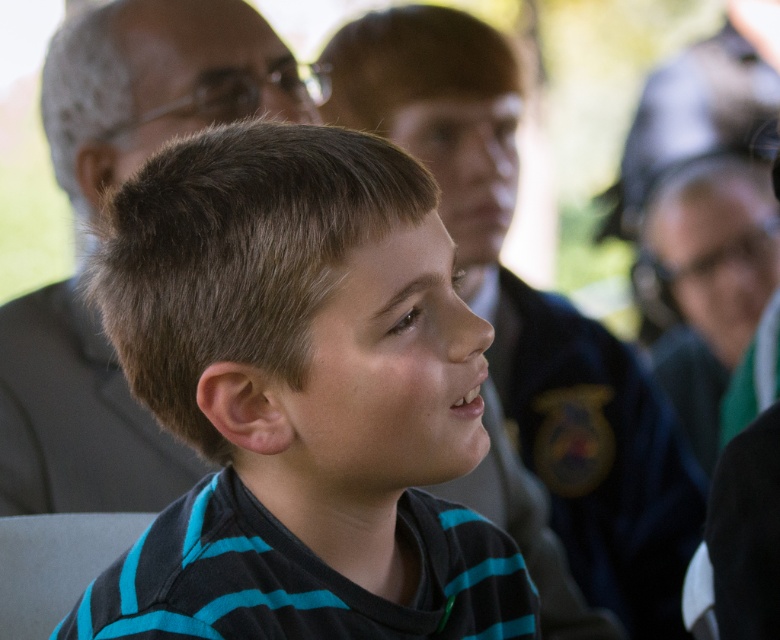
Question: Which point is farther to the camera?

Choices:
 (A) pyautogui.click(x=495, y=72)
 (B) pyautogui.click(x=84, y=470)

Answer: (A)

Question: Among these objects, which one is farthest from the camera?

Choices:
 (A) dark gray suit at upper left
 (B) striped cotton shirt at center

Answer: (A)

Question: Is striped cotton shirt at center wider than dark gray suit at upper left?

Choices:
 (A) no
 (B) yes

Answer: (A)

Question: Is striped cotton shirt at center further to camera compared to dark gray suit at upper left?

Choices:
 (A) no
 (B) yes

Answer: (A)

Question: Does blue striped shirt at center have a larger size compared to dark gray suit at upper left?

Choices:
 (A) no
 (B) yes

Answer: (B)

Question: Which is nearer to the striped cotton shirt at center?

Choices:
 (A) dark gray suit at upper left
 (B) blue striped shirt at center

Answer: (A)